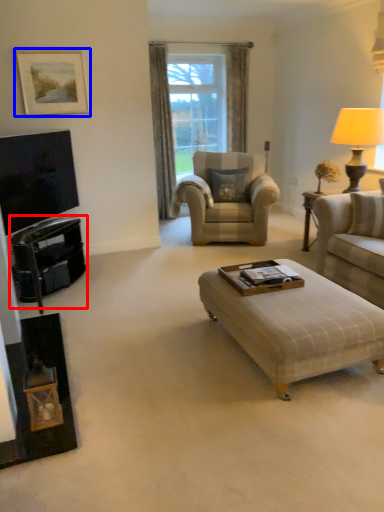
Question: Which object is further to the camera taking this photo, dresser (highlighted by a red box) or picture frame (highlighted by a blue box)?

Choices:
 (A) dresser
 (B) picture frame

Answer: (B)